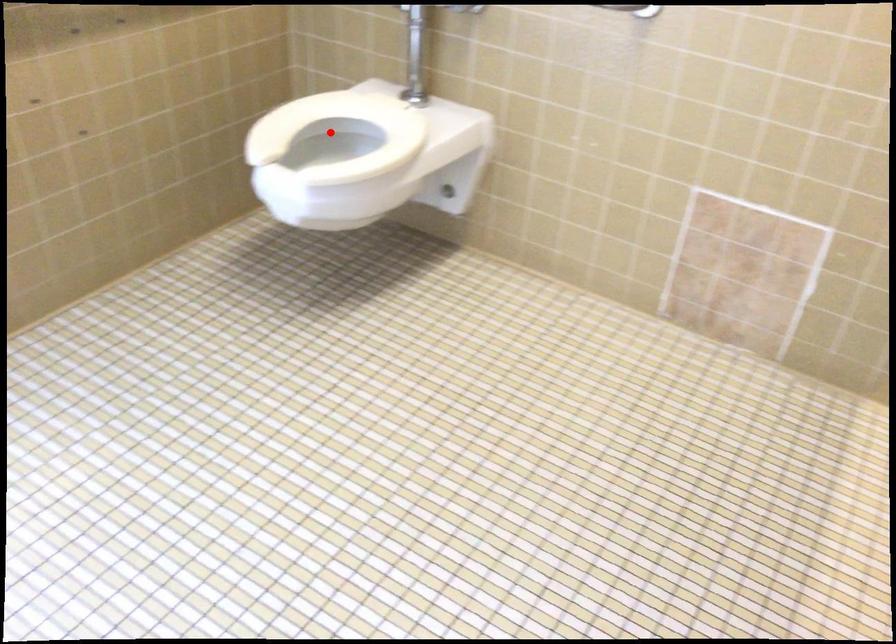
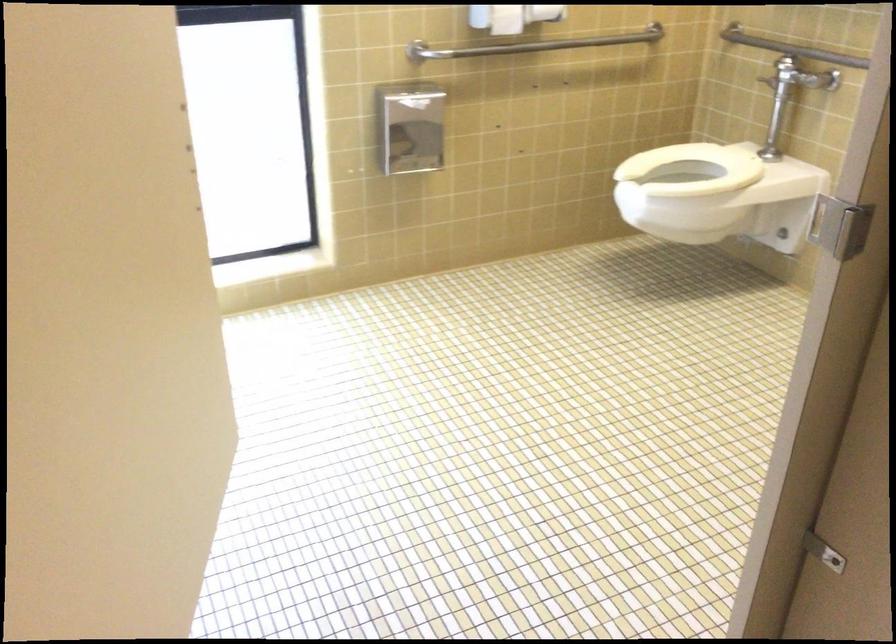
Locate, in the second image, the point that corresponds to the highlighted location in the first image.

(692, 169)